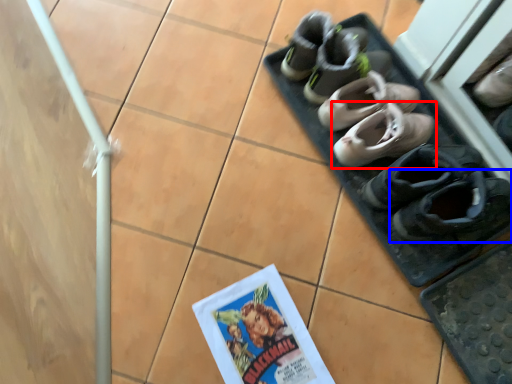
Question: Which object is further to the camera taking this photo, footwear (highlighted by a red box) or footwear (highlighted by a blue box)?

Choices:
 (A) footwear
 (B) footwear

Answer: (A)